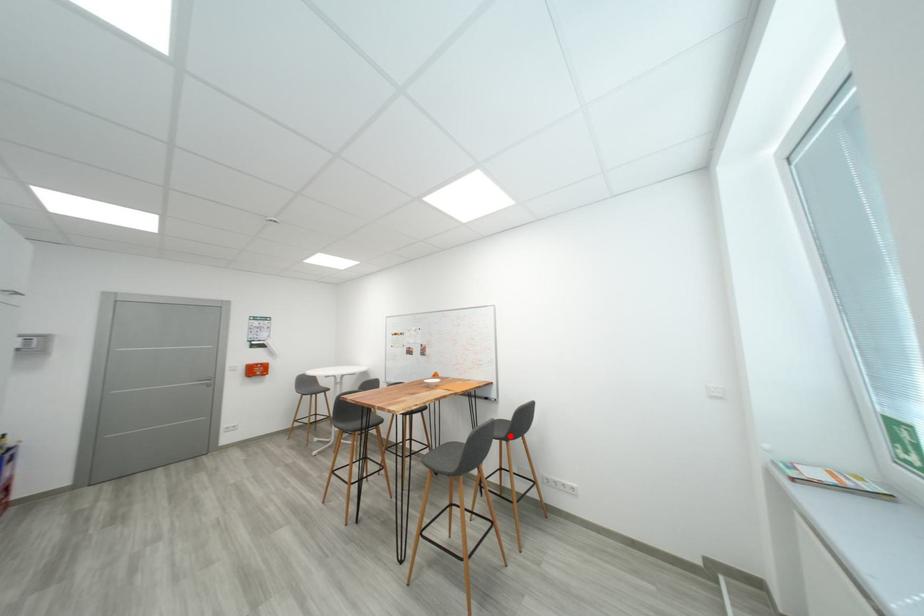
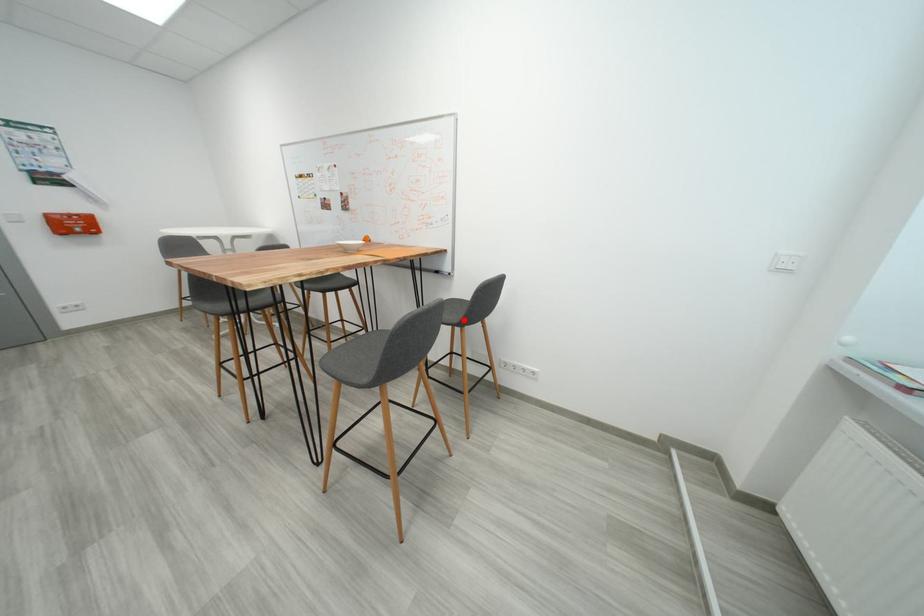
I am providing you with two images of the same scene from different viewpoints. A red point is marked on the first image and another point is marked on the second image. Is the marked point in image1 the same physical position as the marked point in image2?

Yes